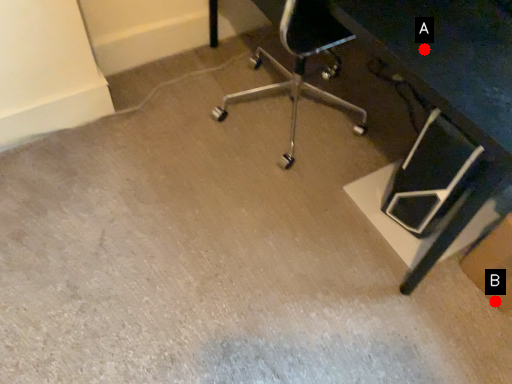
Question: Two points are circled on the image, labeled by A and B beside each circle. Which point appears closest to the camera in this image?

Choices:
 (A) A is closer
 (B) B is closer

Answer: (A)